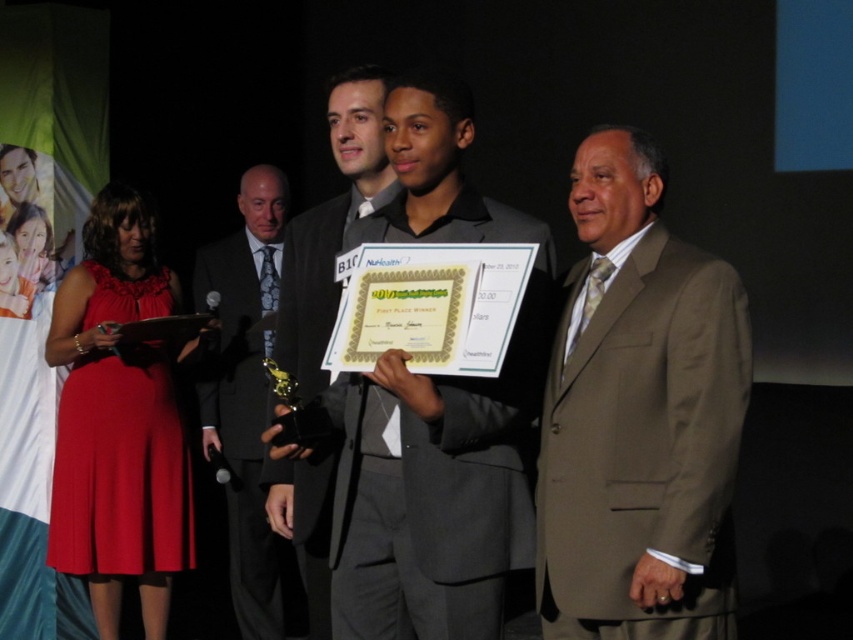
Question: Does tan suit at right have a larger size compared to matte gray suit at center?

Choices:
 (A) no
 (B) yes

Answer: (A)

Question: Among these points, which one is farthest from the camera?

Choices:
 (A) (354, 154)
 (B) (567, 358)

Answer: (A)

Question: Can you confirm if tan suit at right is thinner than dark gray suit at left?

Choices:
 (A) yes
 (B) no

Answer: (B)

Question: Considering the real-world distances, which object is closest to the tan suit at right?

Choices:
 (A) matte black suit at center
 (B) matte gray suit at center
 (C) dark gray suit at left

Answer: (B)

Question: Which object is closer to the camera taking this photo?

Choices:
 (A) matte gray suit at center
 (B) dark gray suit at left
 (C) tan suit at right

Answer: (C)

Question: Can you confirm if tan suit at right is wider than matte gray suit at center?

Choices:
 (A) no
 (B) yes

Answer: (A)